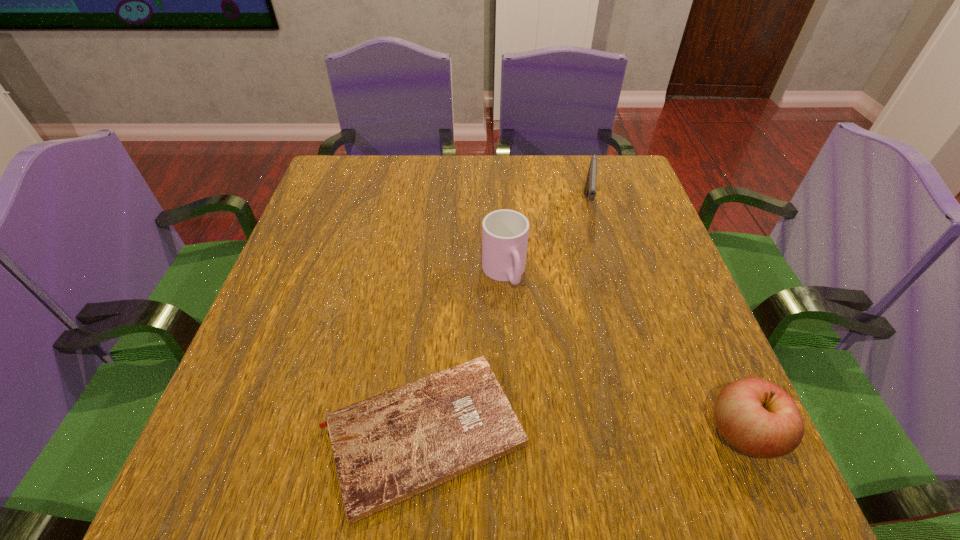
At what (x,y) coordinates should I click in order to perform the action: click on vacant space on the desktop that is between the shortest object and the apple and is positioned with the handle on the side of the second farthest object. Please return your answer as a coordinate pair (x, y). The height and width of the screenshot is (540, 960). Looking at the image, I should click on (573, 433).

Find the location of a particular element. This screenshot has width=960, height=540. vacant spot on the desktop that is between the Bible and the rightmost object and is positioned at the barrel of the farthest object is located at coordinates (573, 433).